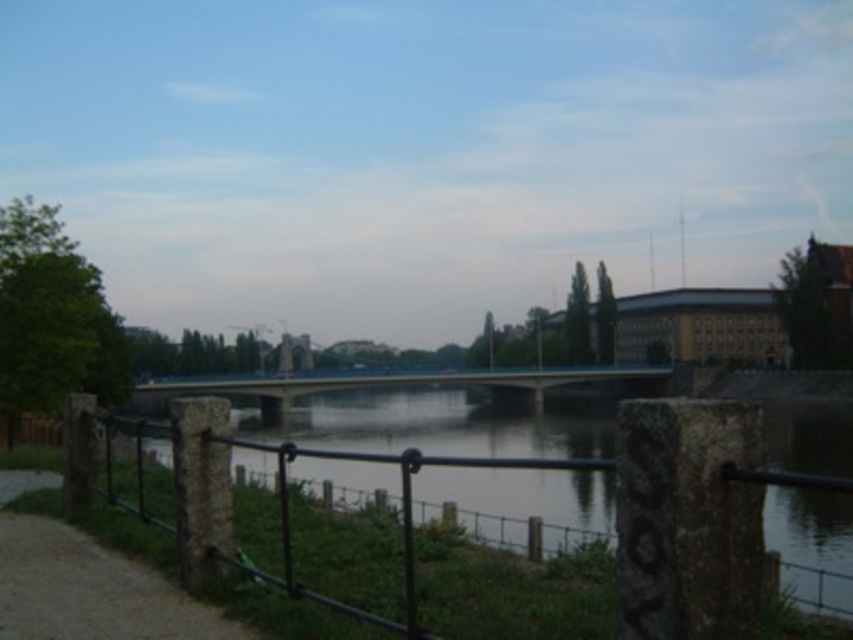
How far apart are brown gravel path at lower left and concrete bridge at center?

They are 404.75 feet apart.

Is brown gravel path at lower left bigger than concrete bridge at center?

Incorrect, brown gravel path at lower left is not larger than concrete bridge at center.

Which is behind, point (105, 561) or point (525, 394)?

Point (525, 394)

Locate an element on the screen. brown gravel path at lower left is located at coordinates (91, 589).

Who is higher up, black metal fence at center or brown gravel path at lower left?

brown gravel path at lower left

Does black metal fence at center have a greater width compared to brown gravel path at lower left?

Yes, black metal fence at center is wider than brown gravel path at lower left.

This screenshot has height=640, width=853. I want to click on black metal fence at center, so click(508, 467).

Where is `black metal fence at center`? This screenshot has height=640, width=853. black metal fence at center is located at coordinates (508, 467).

Can you confirm if black metal fence at center is shorter than concrete bridge at center?

No.

Does black metal fence at center appear over concrete bridge at center?

Correct, black metal fence at center is located above concrete bridge at center.

Is point (338, 458) farther from viewer compared to point (532, 381)?

No.

Identify the location of black metal fence at center. (508, 467).